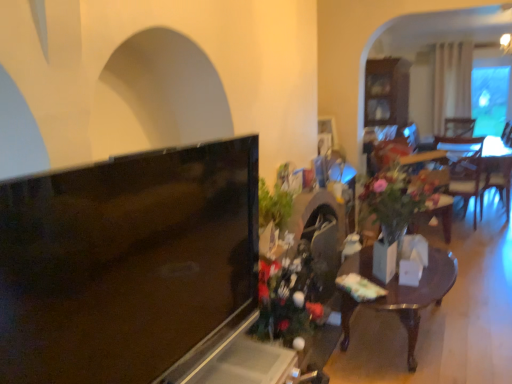
What are the coordinates of `white glossy vase at center` in the screenshot? It's located at (386, 256).

In order to face matte black tv at left, should I rotate leftwards or rightwards?

Turn left by 12.055 degrees to look at matte black tv at left.

Describe the element at coordinates (408, 290) in the screenshot. I see `wooden table at center` at that location.

Describe the element at coordinates (403, 200) in the screenshot. I see `green leafy plant at center-right` at that location.

Where is `white glossy vase at center`? white glossy vase at center is located at coordinates (386, 256).

Does wooden table at center have a lesser height compared to matte black tv at left?

Yes, wooden table at center is shorter than matte black tv at left.

How different are the orientations of wooden table at center and matte black tv at left in degrees?

4.23 degrees.

Is wooden table at center touching matte black tv at left?

wooden table at center and matte black tv at left are not in contact.

Looking at this image, from the image's perspective, is wooden table at center located beneath matte black tv at left?

Yes, from the image's perspective, wooden table at center is below matte black tv at left.

From the image's perspective, is green leafy plant at center-right under wooden table at center?

Actually, green leafy plant at center-right appears above wooden table at center in the image.

From a real-world perspective, between green leafy plant at center-right and wooden table at center, who is vertically higher?

From a 3D spatial view, green leafy plant at center-right is above.

What's the angular difference between green leafy plant at center-right and wooden table at center's facing directions?

The facing directions of green leafy plant at center-right and wooden table at center are 33 degrees apart.

Is wooden table at center located within green leafy plant at center-right?

No.

Is wooden table at center turned away from green leafy plant at center-right?

No, wooden table at center is not facing the opposite direction of green leafy plant at center-right.

In the scene shown: Which is closer, (378, 304) or (444, 196)?

Point (378, 304) is closer to the camera than point (444, 196).

From a real-world perspective, is wooden table at center located higher than green leafy plant at center-right?

No.

Is white glossy vase at center positioned with its back to wooden table at center?

white glossy vase at center does not have its back to wooden table at center.

Does white glossy vase at center have a larger size compared to wooden table at center?

Actually, white glossy vase at center might be smaller than wooden table at center.

Which of these two, white glossy vase at center or wooden table at center, is thinner?

Thinner between the two is white glossy vase at center.

Looking at this image, from a real-world perspective, does white glossy vase at center stand above wooden table at center?

Indeed, from a real-world perspective, white glossy vase at center stands above wooden table at center.

Which is closer to the camera, (x=414, y=365) or (x=392, y=261)?

The point (x=414, y=365) is closer to the camera.

Could you tell me if wooden table at center is facing white glossy vase at center?

No, wooden table at center is not oriented towards white glossy vase at center.

Is wooden table at center at the left side of white glossy vase at center?

In fact, wooden table at center is to the right of white glossy vase at center.

Is green leafy plant at center-right at the back of matte black tv at left?

No, matte black tv at left's orientation is not away from green leafy plant at center-right.

Between point (243, 141) and point (411, 202), which one is positioned in front?

The point (243, 141) is closer.

Between matte black tv at left and green leafy plant at center-right, which one has less height?

With less height is matte black tv at left.

Is matte black tv at left located outside green leafy plant at center-right?

matte black tv at left lies outside green leafy plant at center-right's area.

Measure the distance between green leafy plant at center-right and matte black tv at left.

The distance of green leafy plant at center-right from matte black tv at left is 4.91 feet.

Considering the sizes of objects green leafy plant at center-right and matte black tv at left in the image provided, who is bigger, green leafy plant at center-right or matte black tv at left?

With larger size is green leafy plant at center-right.

Looking at this image, from the image's perspective, which is below, green leafy plant at center-right or matte black tv at left?

matte black tv at left is shown below in the image.

Between green leafy plant at center-right and matte black tv at left, which one appears on the left side from the viewer's perspective?

Positioned to the left is matte black tv at left.

The width and height of the screenshot is (512, 384). What are the coordinates of `television that appears in front of the wooden table at center` in the screenshot? It's located at (125, 262).

Where is `houseplant behind the wooden table at center`? houseplant behind the wooden table at center is located at coordinates (403, 200).

Estimate the real-world distances between objects in this image. Which object is closer to wooden table at center, green leafy plant at center-right or matte black tv at left?

green leafy plant at center-right lies closer to wooden table at center than the other object.

From the image, which object appears to be nearer to matte black tv at left, white glossy vase at center or wooden table at center?

Among the two, wooden table at center is located nearer to matte black tv at left.

Considering their positions, is white glossy vase at center positioned closer to matte black tv at left than green leafy plant at center-right?

The object closer to matte black tv at left is white glossy vase at center.

Considering their positions, is wooden table at center positioned closer to matte black tv at left than green leafy plant at center-right?

wooden table at center.

Which object lies nearer to the anchor point green leafy plant at center-right, white glossy vase at center or matte black tv at left?

white glossy vase at center is closer to green leafy plant at center-right.

Considering their positions, is matte black tv at left positioned closer to green leafy plant at center-right than wooden table at center?

Among the two, wooden table at center is located nearer to green leafy plant at center-right.

Which object lies nearer to the anchor point green leafy plant at center-right, matte black tv at left or white glossy vase at center?

white glossy vase at center is closer to green leafy plant at center-right.

From the image, which object appears to be farther from green leafy plant at center-right, wooden table at center or white glossy vase at center?

The object further to green leafy plant at center-right is wooden table at center.

This screenshot has height=384, width=512. I want to click on vase between wooden table at center and green leafy plant at center-right in the front-back direction, so click(386, 256).

Find the location of a particular element. vase positioned between matte black tv at left and green leafy plant at center-right from near to far is located at coordinates (386, 256).

The image size is (512, 384). Find the location of `table located between matte black tv at left and green leafy plant at center-right in the depth direction`. table located between matte black tv at left and green leafy plant at center-right in the depth direction is located at coordinates (408, 290).

I want to click on table between matte black tv at left and white glossy vase at center along the z-axis, so click(408, 290).